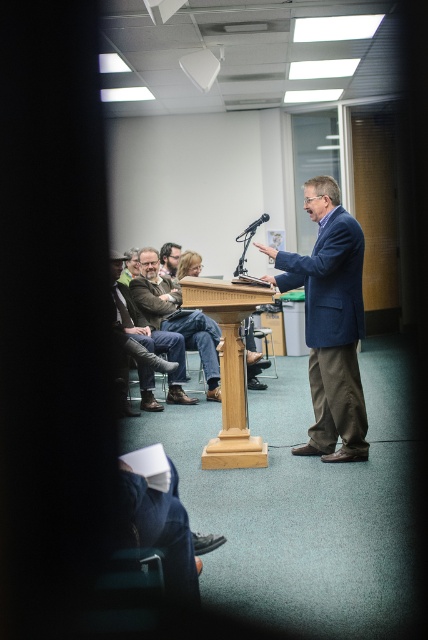
Is light wood podium at center smaller than dark brown leather jacket at center?

Yes, light wood podium at center is smaller than dark brown leather jacket at center.

Can you confirm if light wood podium at center is positioned to the right of dark brown leather jacket at center?

Indeed, light wood podium at center is positioned on the right side of dark brown leather jacket at center.

Between point (235, 392) and point (195, 337), which one is positioned behind?

Positioned behind is point (195, 337).

Find the location of `light wood podium at center`. light wood podium at center is located at coordinates (229, 369).

Does blue fabric suit at center have a greater width compared to brown leather jacket at left?

Incorrect, blue fabric suit at center's width does not surpass brown leather jacket at left's.

Which is below, blue fabric suit at center or brown leather jacket at left?

Positioned lower is brown leather jacket at left.

Between point (327, 307) and point (136, 339), which one is positioned in front?

Point (327, 307)

At what (x,y) coordinates should I click in order to perform the action: click on blue fabric suit at center. Please return your answer as a coordinate pair (x, y). Image resolution: width=428 pixels, height=640 pixels. Looking at the image, I should click on (329, 323).

Who is shorter, blue fabric suit at center or matte brown hair at center?

With less height is matte brown hair at center.

Looking at this image, is blue fabric suit at center positioned at the back of matte brown hair at center?

No, it is in front of matte brown hair at center.

Between point (320, 378) and point (169, 244), which one is positioned in front?

Point (320, 378)

The width and height of the screenshot is (428, 640). Find the location of `blue fabric suit at center`. blue fabric suit at center is located at coordinates tap(329, 323).